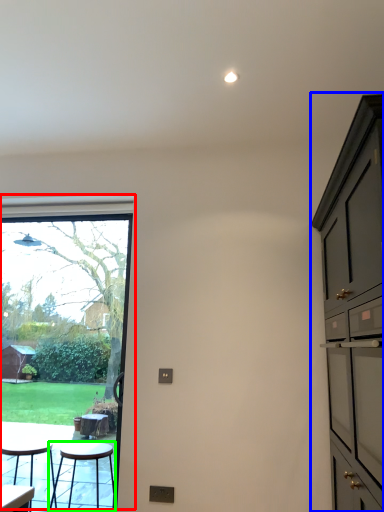
Question: Which object is the closest to the window (highlighted by a red box)? Choose among these: cabinetry (highlighted by a blue box) or stool (highlighted by a green box).

Choices:
 (A) cabinetry
 (B) stool

Answer: (B)